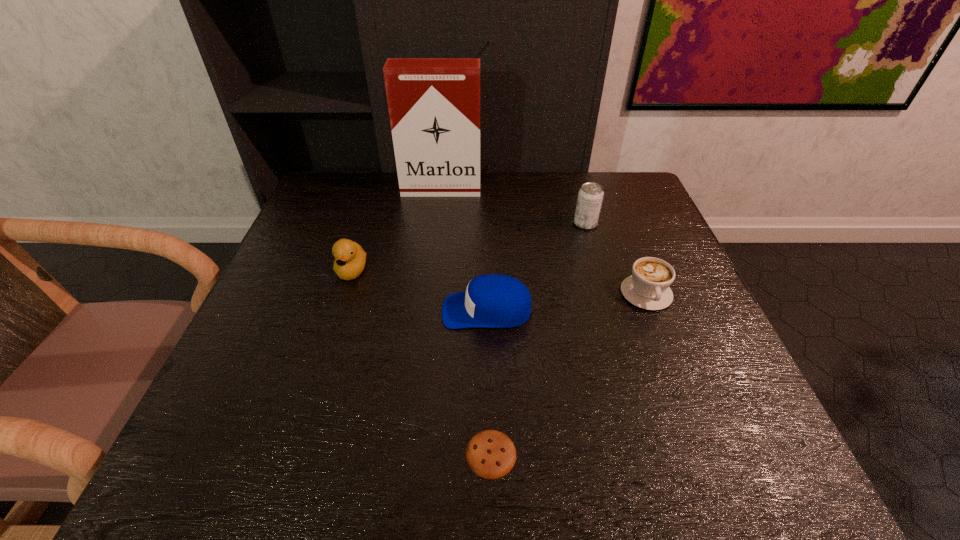
Locate an element on the screen. This screenshot has height=540, width=960. object present at the left edge is located at coordinates (350, 258).

Locate an element on the screen. object present at the right edge is located at coordinates (648, 288).

Where is `vacant space at the far edge of the desktop`? This screenshot has height=540, width=960. vacant space at the far edge of the desktop is located at coordinates (559, 201).

The width and height of the screenshot is (960, 540). In order to click on free spot at the near edge of the desktop in this screenshot , I will do `click(369, 437)`.

In the image, there is a desktop. What are the coordinates of `vacant space at the left edge` in the screenshot? It's located at (308, 261).

This screenshot has height=540, width=960. I want to click on blank space at the right edge, so click(x=607, y=228).

In the image, there is a desktop. Where is `free region at the far left corner`? This screenshot has width=960, height=540. free region at the far left corner is located at coordinates (338, 211).

This screenshot has height=540, width=960. I want to click on vacant space at the far right corner of the desktop, so click(631, 174).

The width and height of the screenshot is (960, 540). I want to click on vacant space at the near right corner of the desktop, so click(x=717, y=429).

Identify the location of vacant space in between the soda can and the duckling. The height and width of the screenshot is (540, 960). (468, 247).